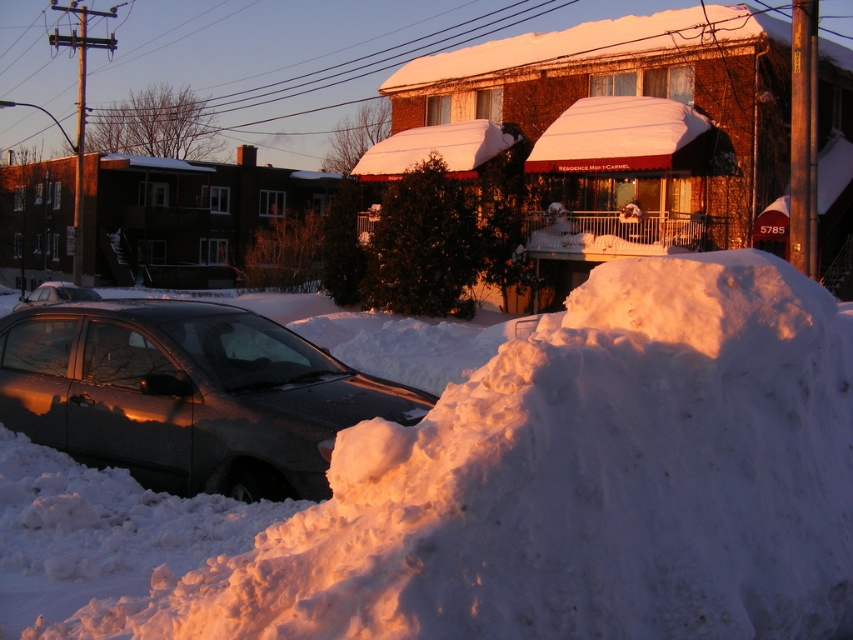
Question: Is satin black car at lower left below shiny black car at left?

Choices:
 (A) yes
 (B) no

Answer: (A)

Question: Is white fluffy snow at lower left further to camera compared to shiny black car at left?

Choices:
 (A) no
 (B) yes

Answer: (A)

Question: Which point is farther to the camera?

Choices:
 (A) white fluffy snow at lower left
 (B) shiny black car at left

Answer: (B)

Question: Which point is closer to the camera?

Choices:
 (A) shiny black car at left
 (B) satin black car at lower left

Answer: (B)

Question: Which object is positioned closest to the shiny black car at left?

Choices:
 (A) satin black car at lower left
 (B) white fluffy snow at lower left

Answer: (A)

Question: Does white fluffy snow at lower left come in front of satin black car at lower left?

Choices:
 (A) yes
 (B) no

Answer: (A)